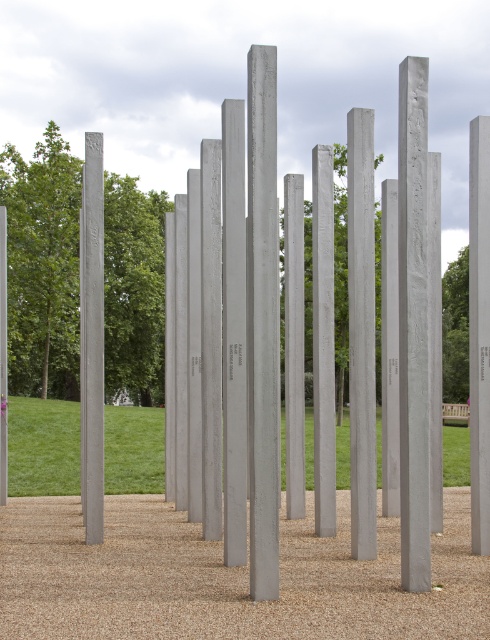
Can you confirm if sanded concrete pillar at right is taller than sanded concrete pole at left?

No.

Which of these two, sanded concrete pillar at right or sanded concrete pole at left, stands taller?

With more height is sanded concrete pole at left.

Is point (409, 112) closer to camera compared to point (95, 224)?

Yes, point (409, 112) is in front of point (95, 224).

Find the location of `sanded concrete pillar at right`. sanded concrete pillar at right is located at coordinates (413, 323).

Who is more forward, (468, 220) or (312, 221)?

Point (312, 221)

Does satin silver pole at right lie in front of satin gray pole at center?

That is True.

Is point (478, 534) more distant than point (329, 496)?

No, it is in front of (329, 496).

Find the location of a particular element. The height and width of the screenshot is (640, 490). satin silver pole at right is located at coordinates (479, 332).

Between sanded concrete pillars at center and sanded concrete pole at center, which one appears on the left side from the viewer's perspective?

sanded concrete pillars at center

Which is in front, point (258, 291) or point (266, 365)?

Point (258, 291)

Is point (360, 554) positioned behind point (250, 220)?

Yes.

Find the location of a particular element. sanded concrete pillars at center is located at coordinates (262, 321).